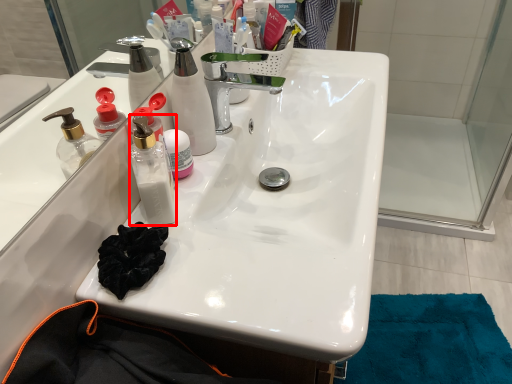
Question: From the image, what is the correct spatial relationship of bottle (annotated by the red box) in relation to bottle?

Choices:
 (A) right
 (B) left

Answer: (B)